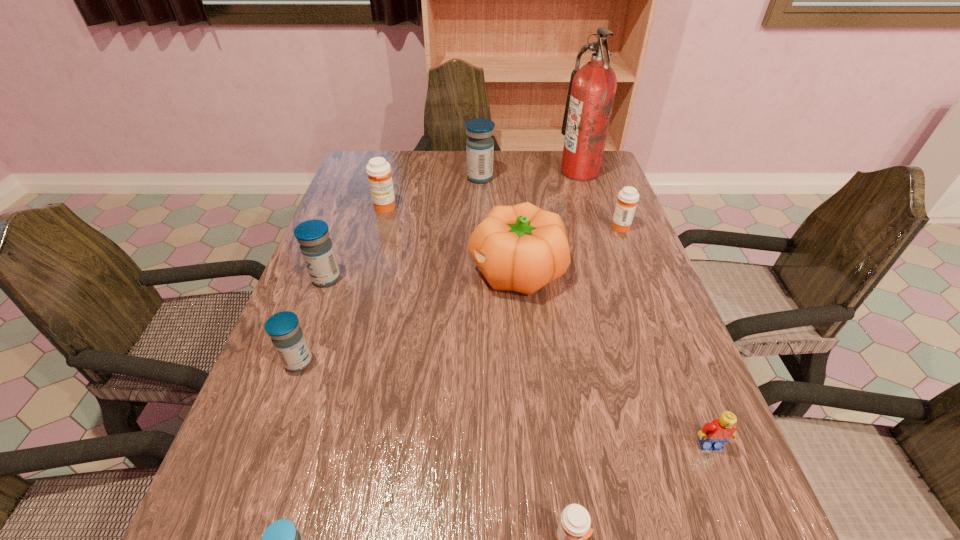
Where is `medicine located at the right edge`? Image resolution: width=960 pixels, height=540 pixels. medicine located at the right edge is located at coordinates (628, 197).

Locate an element on the screen. Lego that is at the right edge is located at coordinates [x=721, y=430].

Where is `object that is positioned at the far right corner`? This screenshot has height=540, width=960. object that is positioned at the far right corner is located at coordinates (592, 88).

The height and width of the screenshot is (540, 960). What are the coordinates of `free location at the far edge of the desktop` in the screenshot? It's located at (552, 166).

Locate an element on the screen. This screenshot has height=540, width=960. vacant space at the near edge is located at coordinates (503, 525).

Where is `free space at the left edge of the desktop`? free space at the left edge of the desktop is located at coordinates (345, 235).

Locate an element on the screen. vacant region at the right edge is located at coordinates (664, 473).

Where is `empty space between the red fire extinguisher and the Lego`? The image size is (960, 540). empty space between the red fire extinguisher and the Lego is located at coordinates (645, 308).

The height and width of the screenshot is (540, 960). What are the coordinates of `vacant space that is in between the leftmost orange medicine and the pumpkin` in the screenshot? It's located at (450, 239).

Image resolution: width=960 pixels, height=540 pixels. In order to click on empty location between the farthest orange medicine and the second smallest blue medicine in this screenshot , I will do `click(342, 285)`.